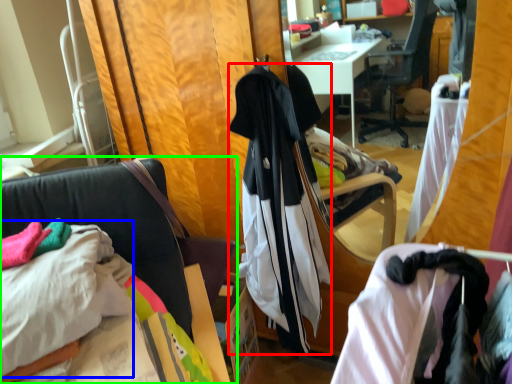
Question: Which object is positioned farthest from garment (highlighted by a red box)? Select from sheet (highlighted by a blue box) and chair (highlighted by a green box).

Choices:
 (A) sheet
 (B) chair

Answer: (A)